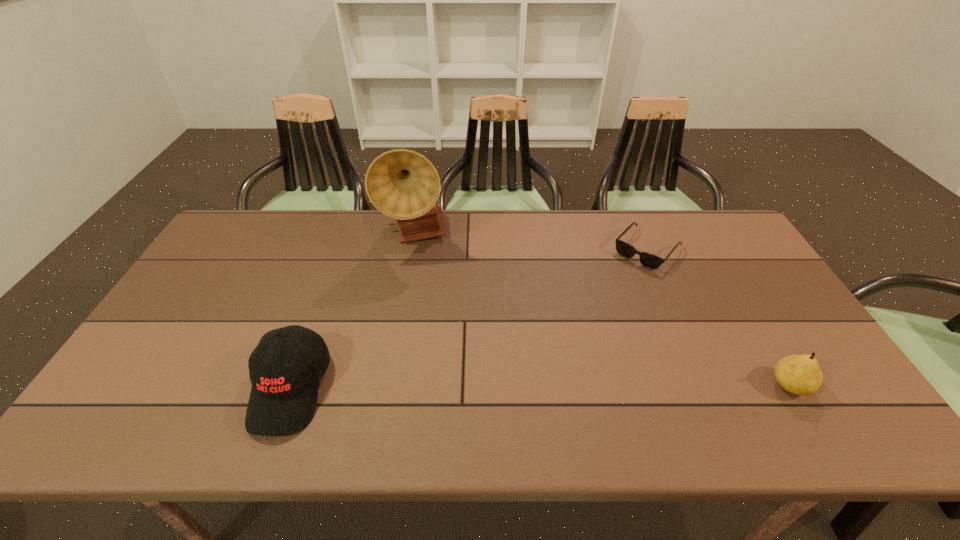
This screenshot has height=540, width=960. What are the coordinates of `baseball cap` in the screenshot? It's located at (283, 397).

Where is `the rightmost object`? the rightmost object is located at coordinates (799, 374).

You are a GUI agent. You are given a task and a screenshot of the screen. Output one action in this format:
    pyautogui.click(x=<x>, y=<y>)
    Task: Click on the third object from left to right
    
    Given the screenshot: What is the action you would take?
    pyautogui.click(x=648, y=260)

I want to click on sunglasses, so click(x=648, y=260).

At what (x,y) coordinates should I click in order to perform the action: click on the third object from right to left. Please return your answer as a coordinate pair (x, y). The width and height of the screenshot is (960, 540). Looking at the image, I should click on (403, 184).

You are a GUI agent. You are given a task and a screenshot of the screen. Output one action in this format:
    pyautogui.click(x=<x>, y=<y>)
    Task: Click on the tallest object
    The width and height of the screenshot is (960, 540).
    Given the screenshot: What is the action you would take?
    pyautogui.click(x=403, y=184)

Where is `blank space located on the back of the pear`? This screenshot has height=540, width=960. blank space located on the back of the pear is located at coordinates (749, 318).

You are a GUI agent. You are given a task and a screenshot of the screen. Output one action in this format:
    pyautogui.click(x=<x>, y=<y>)
    Task: Click on the free region located 0.070m at the front lenses of the shortest object
    
    Given the screenshot: What is the action you would take?
    pyautogui.click(x=620, y=279)

Identify the location of vacant position located at the front lenses of the shortest object. (566, 338).

Image resolution: width=960 pixels, height=540 pixels. I want to click on free space located 0.070m at the front lenses of the shortest object, so click(620, 279).